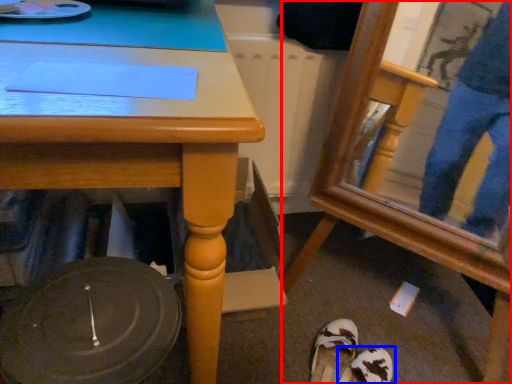
Question: Which of the following is the farthest to the observer, swivel chair (highlighted by a red box) or footwear (highlighted by a blue box)?

Choices:
 (A) swivel chair
 (B) footwear

Answer: (B)